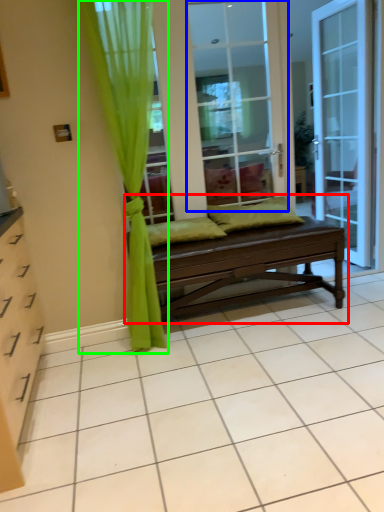
Question: Considering the real-world distances, which object is farthest from studio couch (highlighted by a red box)? screen door (highlighted by a blue box) or curtain (highlighted by a green box)?

Choices:
 (A) screen door
 (B) curtain

Answer: (A)